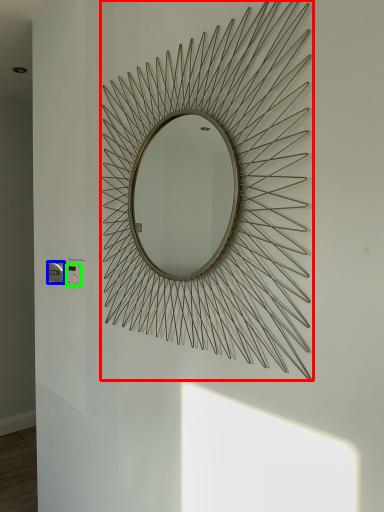
Question: Which object is the closest to the mirror (highlighted by a red box)? Choose among these: electric outlet (highlighted by a blue box) or electric outlet (highlighted by a green box).

Choices:
 (A) electric outlet
 (B) electric outlet

Answer: (B)